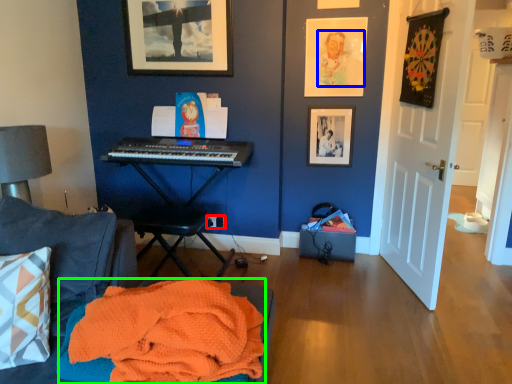
Question: Which object is the farthest from power outlet (highlighted by a red box)? Choose among these: person (highlighted by a blue box) or blanket (highlighted by a green box).

Choices:
 (A) person
 (B) blanket

Answer: (B)